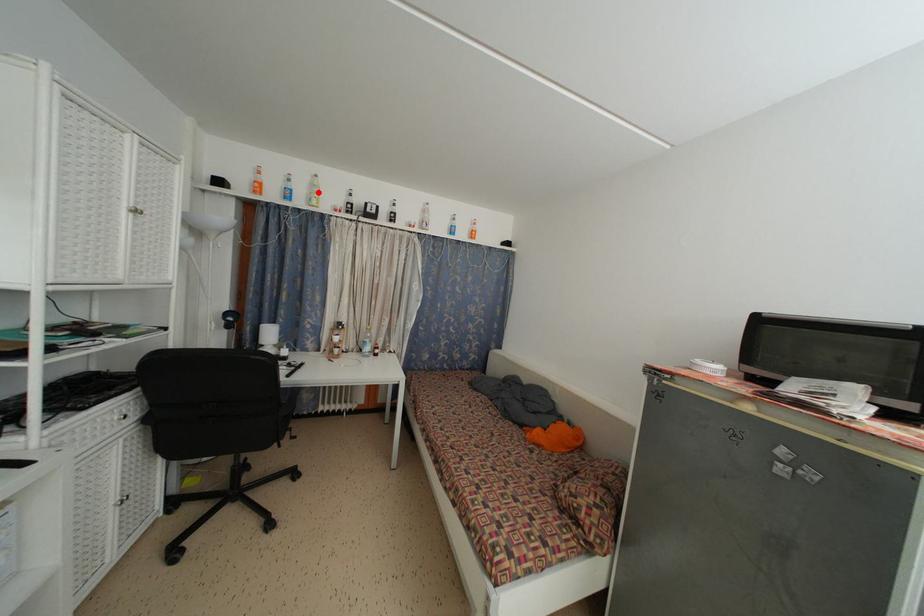
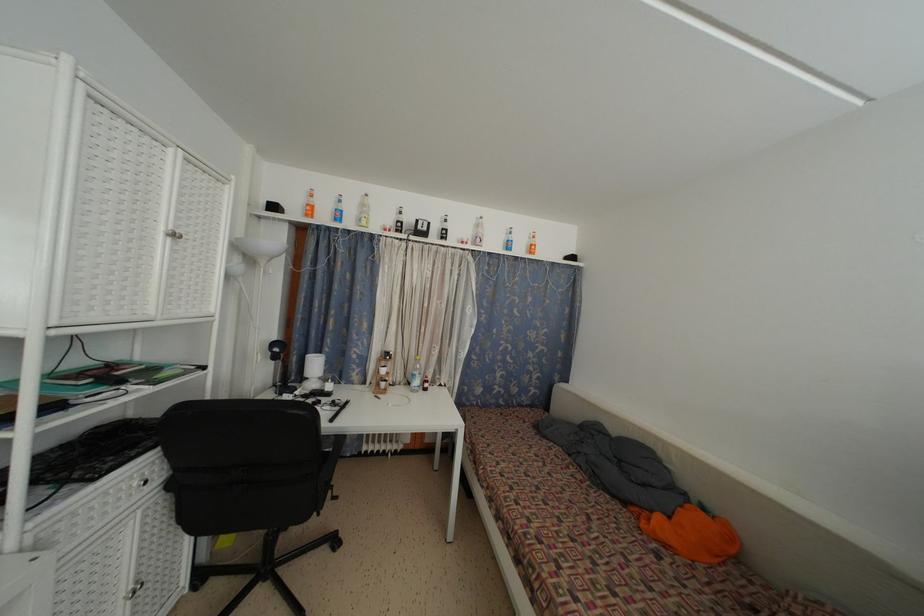
The point at the highlighted location is marked in the first image. Where is the corresponding point in the second image?

(368, 213)